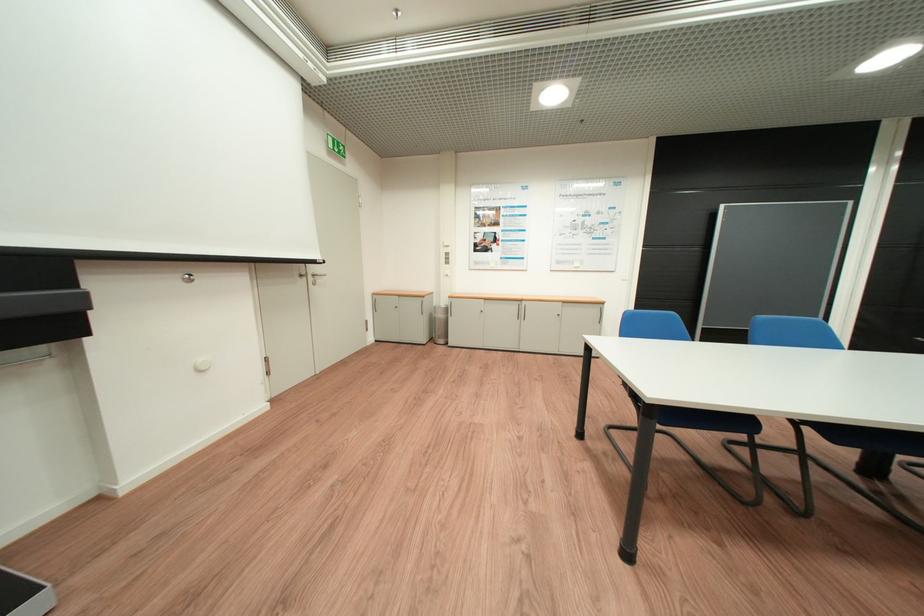
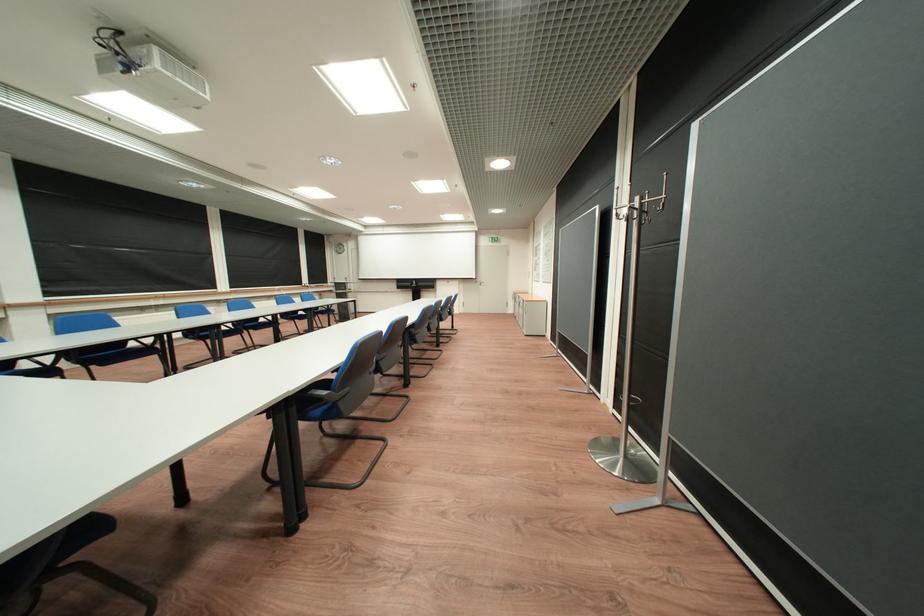
Where in the second image is the point corresponding to [331,257] from the first image?

(487, 278)